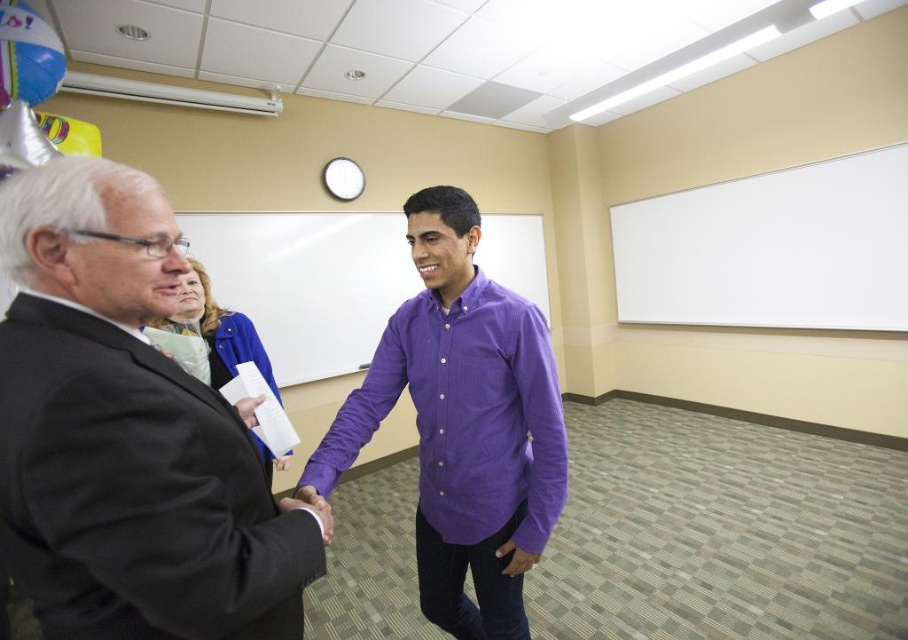
Question: Is white matte board at upper right below purple cotton shirt at center?

Choices:
 (A) yes
 (B) no

Answer: (B)

Question: Which of the following is the farthest from the observer?

Choices:
 (A) purple cotton shirt at center
 (B) purple shirt at center

Answer: (B)

Question: Estimate the real-world distances between objects in this image. Which object is farther from the black suit at left?

Choices:
 (A) white matte board at upper right
 (B) purple cotton shirt at center

Answer: (A)

Question: Is white matte board at upper right below purple cotton shirt at center?

Choices:
 (A) yes
 (B) no

Answer: (B)

Question: Which object is positioned closest to the purple cotton shirt at center?

Choices:
 (A) purple shirt at center
 (B) white matte board at upper right
 (C) black suit at left

Answer: (C)

Question: Is white matte board at upper right wider than purple cotton shirt at center?

Choices:
 (A) yes
 (B) no

Answer: (A)